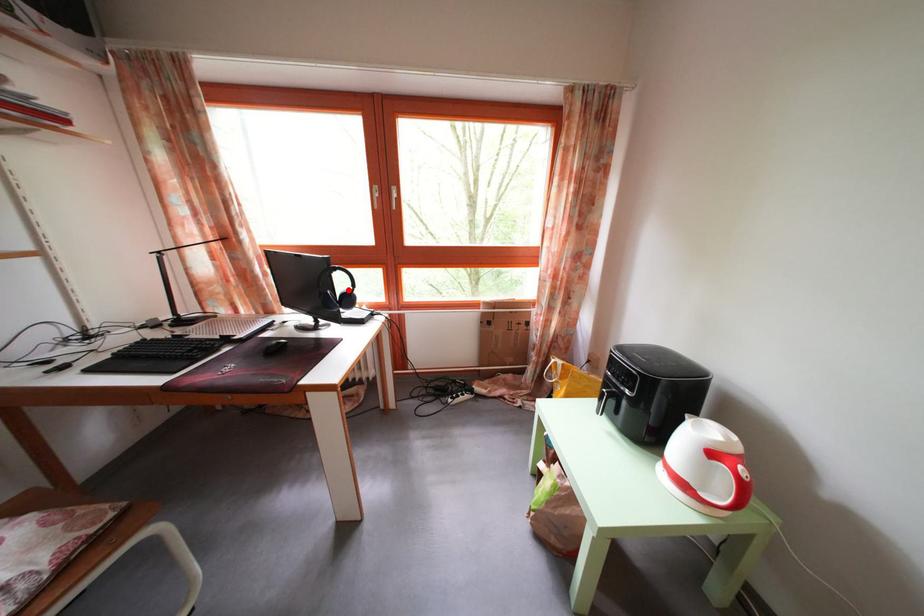
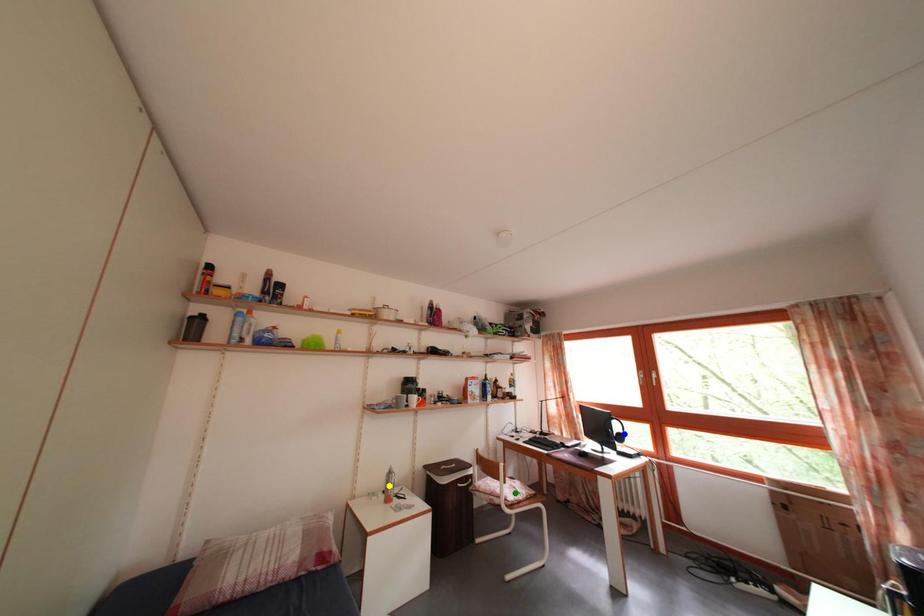
Question: I am providing you with two images of the same scene from different viewpoints. A red point is marked on the first image. You are given multiple points on the second image. Which point in image 2 represents the same 3d spot as the red point in image 1?

Choices:
 (A) blue point
 (B) yellow point
 (C) green point

Answer: (A)